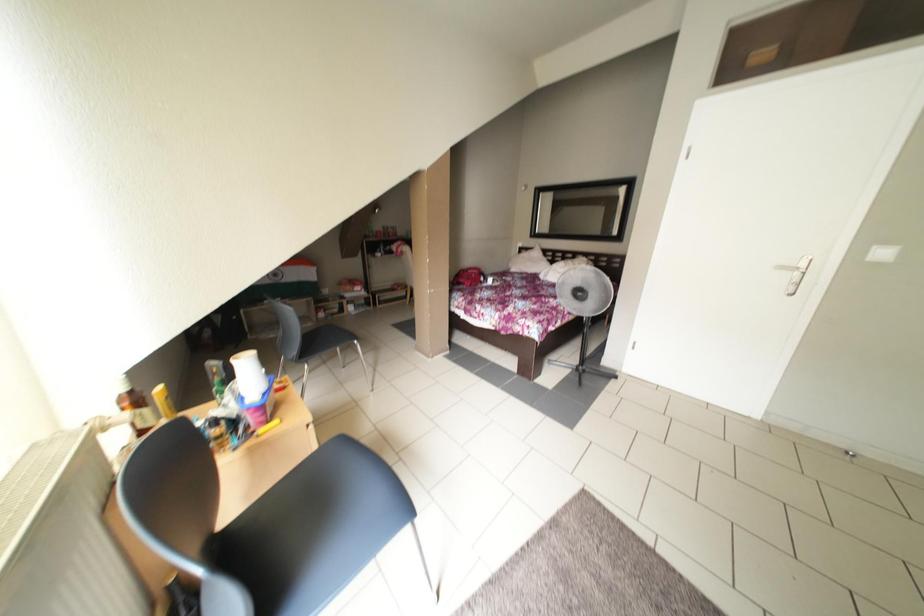
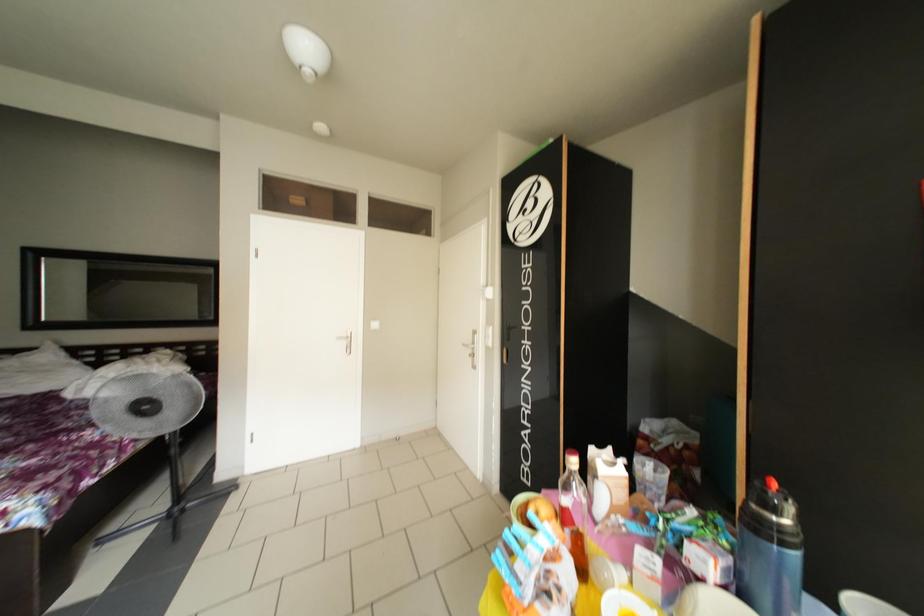
Question: The camera is either moving clockwise (left) or counter-clockwise (right) around the object. The first image is from the beginning of the video and the second image is from the end. Is the camera moving left or right when shooting the video?

Choices:
 (A) Left
 (B) Right

Answer: (A)